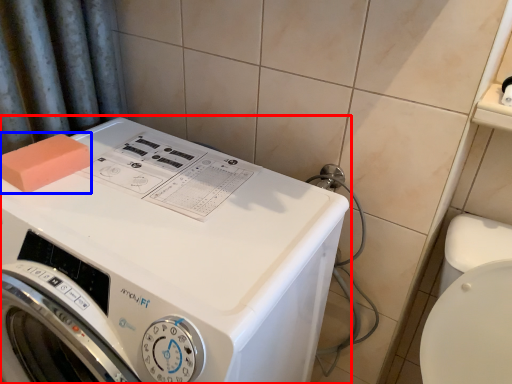
Question: Which point is further to the camera, washing machine (highlighted by a red box) or soap (highlighted by a blue box)?

Choices:
 (A) washing machine
 (B) soap

Answer: (B)